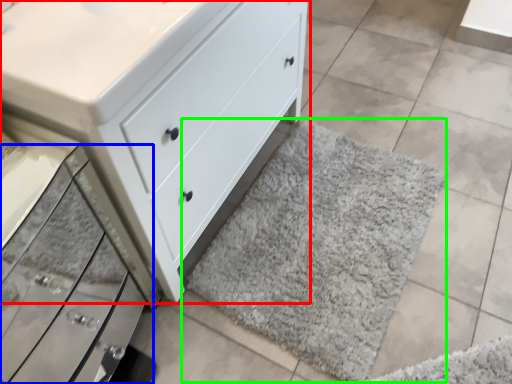
Question: Which is nearer to the chest of drawers (highlighted by a red box)? drawer (highlighted by a blue box) or bath mat (highlighted by a green box).

Choices:
 (A) drawer
 (B) bath mat

Answer: (A)